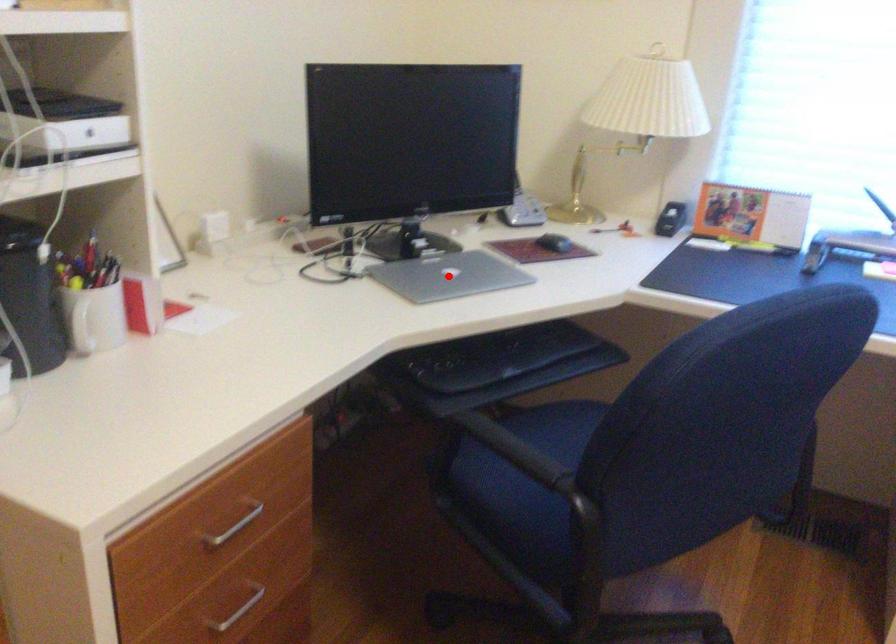
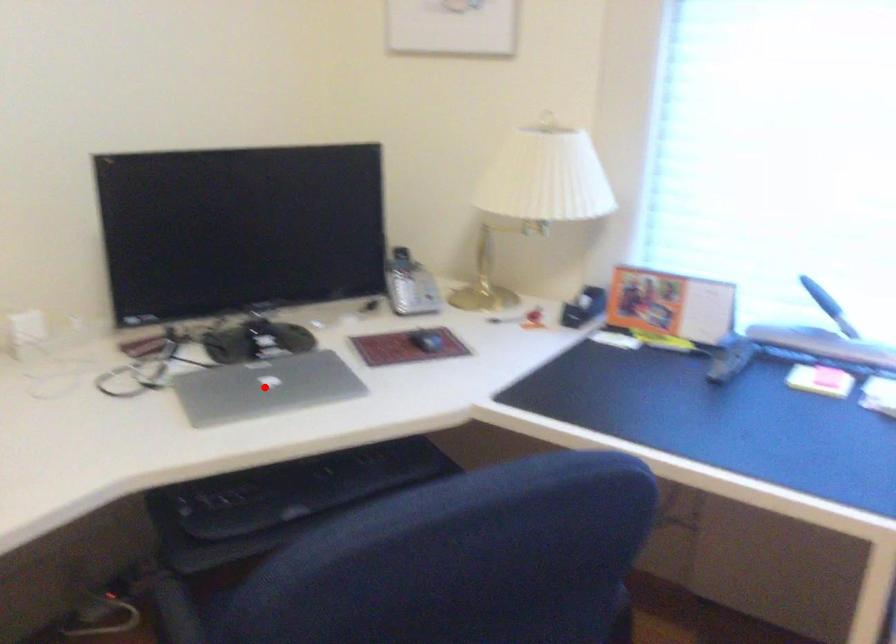
I am providing you with two images of the same scene from different viewpoints. A red point is marked on the first image and another point is marked on the second image. Is the marked point in image1 the same physical position as the marked point in image2?

Yes